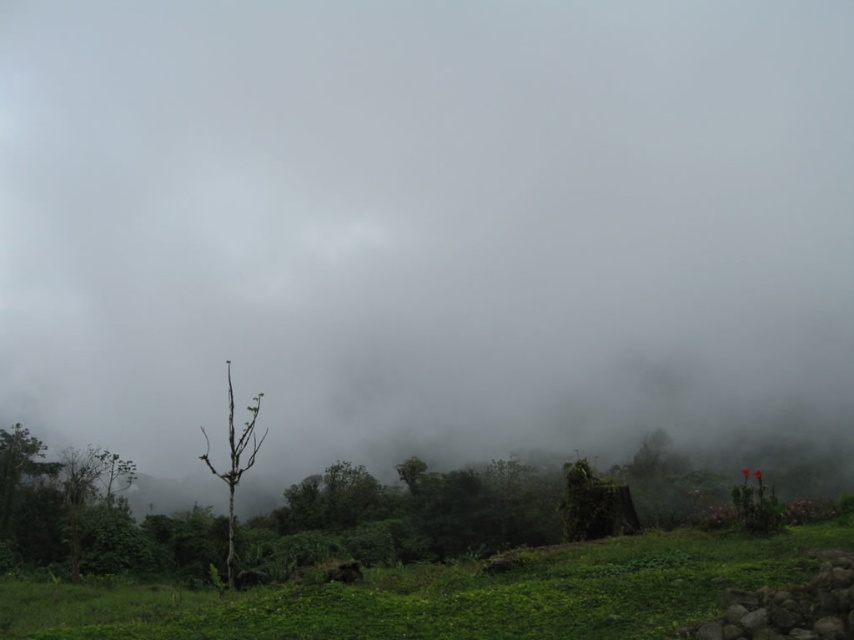
Question: Which object appears farthest from the camera in this image?

Choices:
 (A) green leafy grass at lower center
 (B) bare wood tree at center

Answer: (B)

Question: Can you confirm if green leafy grass at lower center is positioned below bare wood tree at center?

Choices:
 (A) yes
 (B) no

Answer: (B)

Question: Does green leafy grass at lower center lie in front of bare wood tree at center?

Choices:
 (A) yes
 (B) no

Answer: (A)

Question: Can you confirm if green leafy grass at lower center is bigger than bare wood tree at center?

Choices:
 (A) no
 (B) yes

Answer: (A)

Question: Which object is farther from the camera taking this photo?

Choices:
 (A) green leafy grass at lower center
 (B) bare wood tree at center

Answer: (B)

Question: Which point is farther to the camera?

Choices:
 (A) (256, 404)
 (B) (681, 609)

Answer: (A)